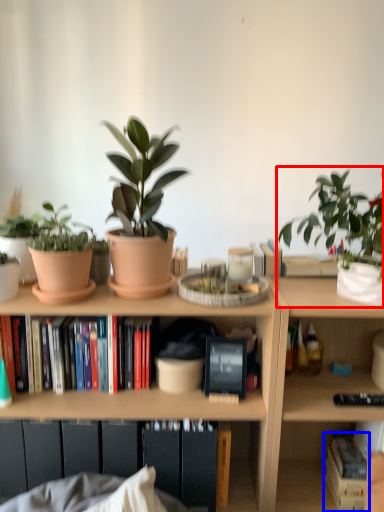
Question: Among these objects, which one is nearest to the camera, houseplant (highlighted by a red box) or book (highlighted by a blue box)?

Choices:
 (A) houseplant
 (B) book

Answer: (B)